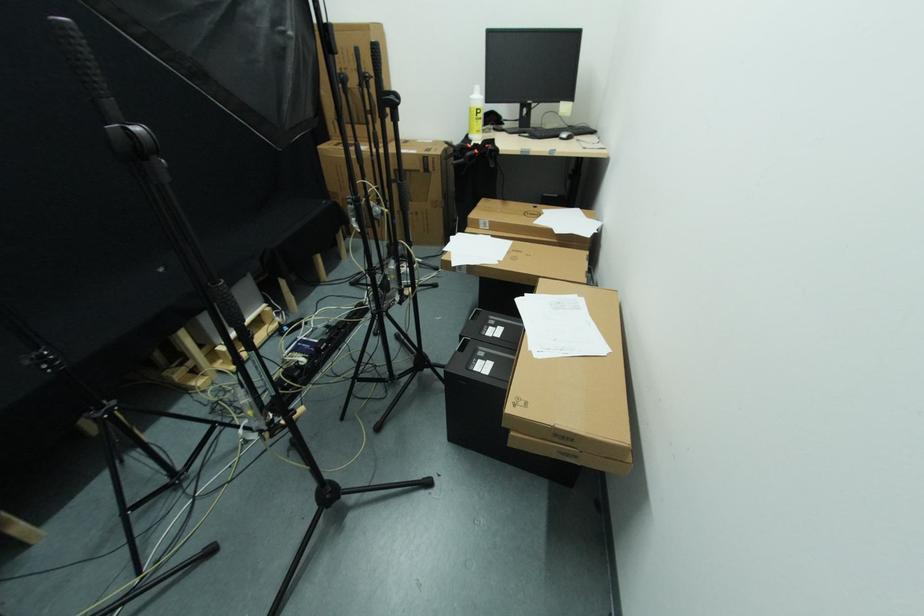
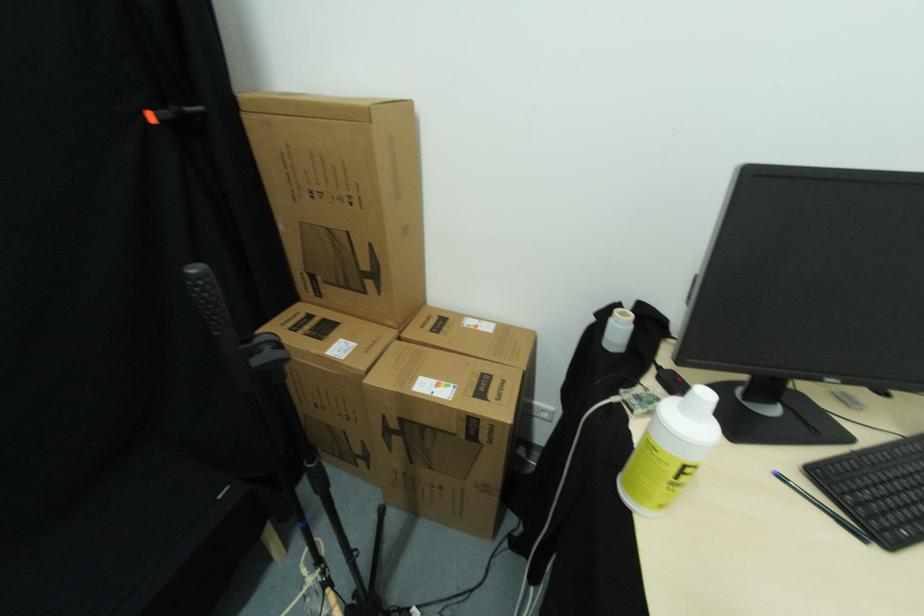
In the second image, find the point that corresponds to (x=523, y=138) in the first image.

(784, 479)